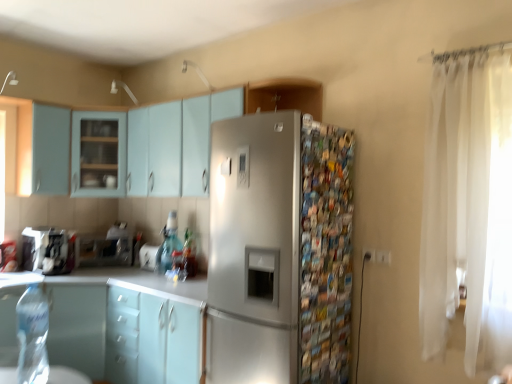
At what (x,y) coordinates should I click in order to perform the action: click on vacant space situated on the left part of teal glass bottle at center. Please return your answer as a coordinate pair (x, y). This screenshot has width=512, height=384. Looking at the image, I should click on (151, 270).